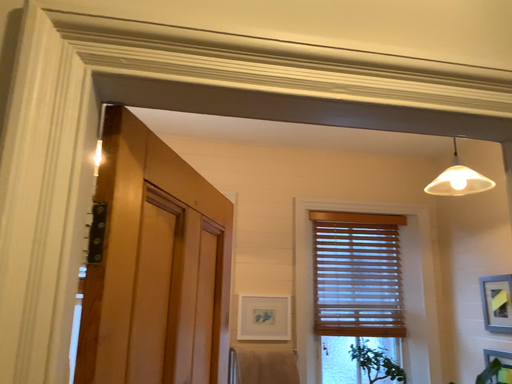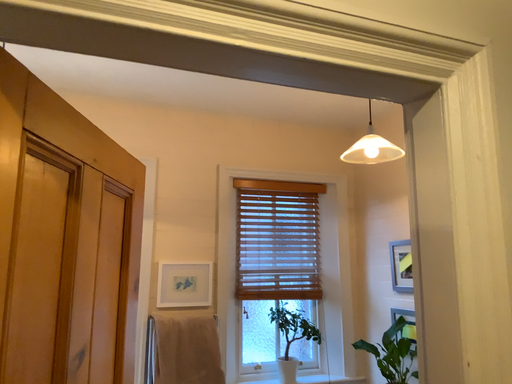
Question: How did the camera likely rotate when shooting the video?

Choices:
 (A) rotated left
 (B) rotated right

Answer: (B)